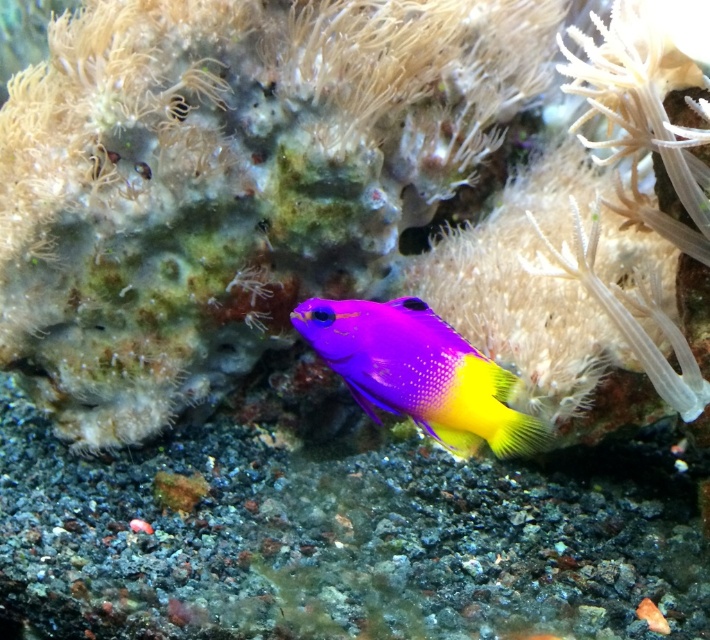
Question: Is purple glossy fish at center to the right of translucent white anemone at upper right from the viewer's perspective?

Choices:
 (A) no
 (B) yes

Answer: (A)

Question: Can you confirm if purple glossy fish at center is wider than translucent white anemone at upper right?

Choices:
 (A) yes
 (B) no

Answer: (A)

Question: Which object is farther from the camera taking this photo?

Choices:
 (A) translucent white anemone at upper right
 (B) purple glossy fish at center

Answer: (A)

Question: Can you confirm if purple glossy fish at center is smaller than translucent white anemone at upper right?

Choices:
 (A) no
 (B) yes

Answer: (B)

Question: Which object appears farthest from the camera in this image?

Choices:
 (A) translucent white anemone at upper right
 (B) purple glossy fish at center

Answer: (A)

Question: Which point appears closest to the camera in this image?

Choices:
 (A) pyautogui.click(x=359, y=404)
 (B) pyautogui.click(x=617, y=310)

Answer: (B)